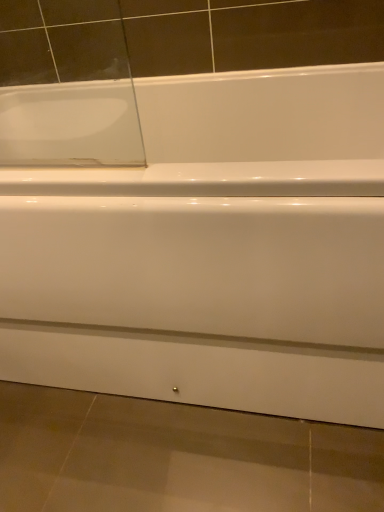
The height and width of the screenshot is (512, 384). What do you see at coordinates (212, 251) in the screenshot? I see `white glossy bathtub at center` at bounding box center [212, 251].

Where is `white glossy bathtub at center`? The image size is (384, 512). white glossy bathtub at center is located at coordinates (212, 251).

Measure the distance between white glossy bathtub at center and camera.

white glossy bathtub at center is 22.65 inches from camera.

Locate an element on the screen. This screenshot has width=384, height=512. white glossy bathtub at center is located at coordinates (212, 251).